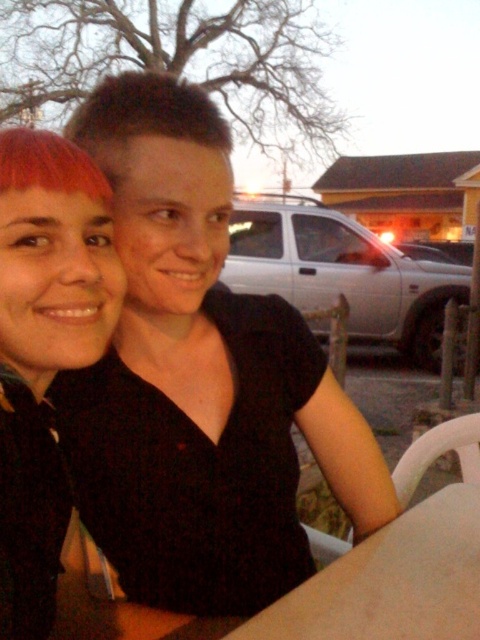
Does black matte shirt at center appear on the right side of matte black hair at left?

Indeed, black matte shirt at center is positioned on the right side of matte black hair at left.

Which is behind, point (285, 480) or point (49, 346)?

The point (285, 480) is behind.

Does point (224, 323) lie behind point (67, 212)?

Yes.

You are a GUI agent. You are given a task and a screenshot of the screen. Output one action in this format:
    pyautogui.click(x=<x>, y=<y>)
    Task: Click on the black matte shirt at center
    The image size is (480, 640).
    Given the screenshot: What is the action you would take?
    pyautogui.click(x=200, y=380)

Is black matte shirt at center wider than dark brown short hair at upper center?

Yes, black matte shirt at center is wider than dark brown short hair at upper center.

At what (x,y) coordinates should I click in order to perform the action: click on black matte shirt at center. Please return your answer as a coordinate pair (x, y). Looking at the image, I should click on (200, 380).

Which is behind, point (288, 502) or point (75, 131)?

The point (288, 502) is behind.

Where is `black matte shirt at center`? black matte shirt at center is located at coordinates (200, 380).

Between matte black hair at left and dark brown short hair at upper center, which one is positioned lower?

Positioned lower is matte black hair at left.

Which of these two, matte black hair at left or dark brown short hair at upper center, stands shorter?

dark brown short hair at upper center is shorter.

Describe the element at coordinates (45, 349) in the screenshot. I see `matte black hair at left` at that location.

The height and width of the screenshot is (640, 480). Find the location of `matte black hair at left`. matte black hair at left is located at coordinates (45, 349).